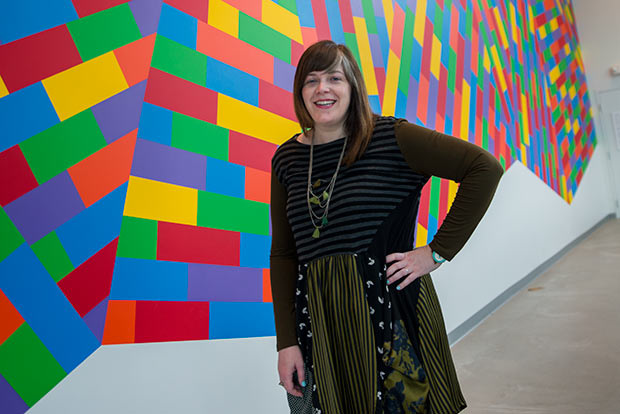
Where is `wall art`? This screenshot has height=414, width=620. wall art is located at coordinates (128, 139), (467, 55).